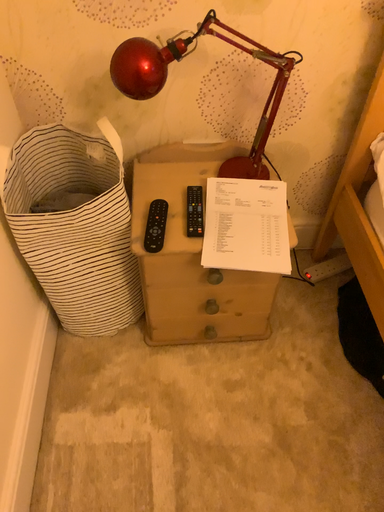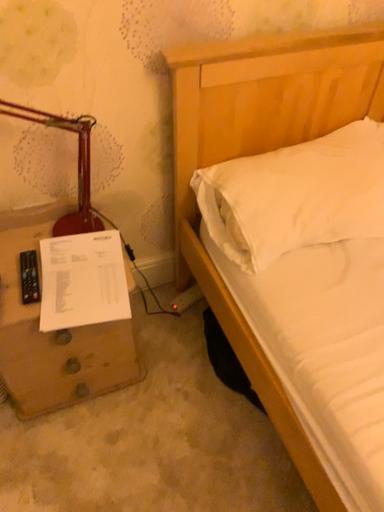
Question: How did the camera likely rotate when shooting the video?

Choices:
 (A) rotated left
 (B) rotated right

Answer: (B)